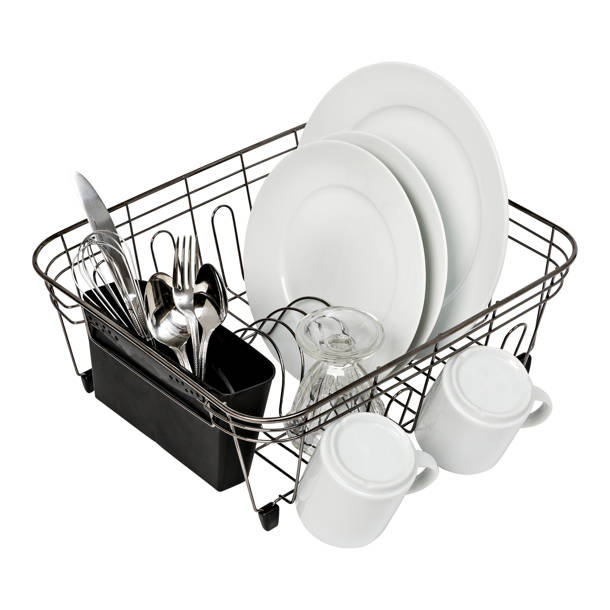
Find the location of `plates`. plates is located at coordinates (321, 226), (404, 168), (446, 149).